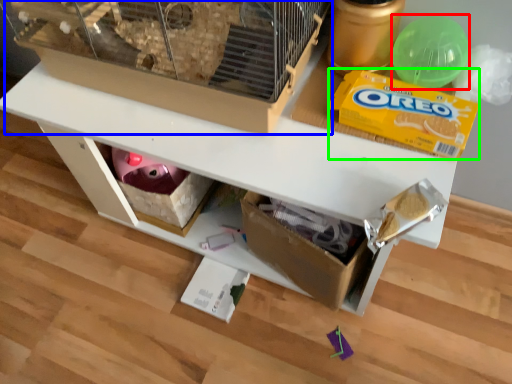
Question: Which object is the farthest from toy (highlighted by a red box)? Choose among these: bird cage (highlighted by a blue box) or cereal (highlighted by a green box).

Choices:
 (A) bird cage
 (B) cereal

Answer: (A)